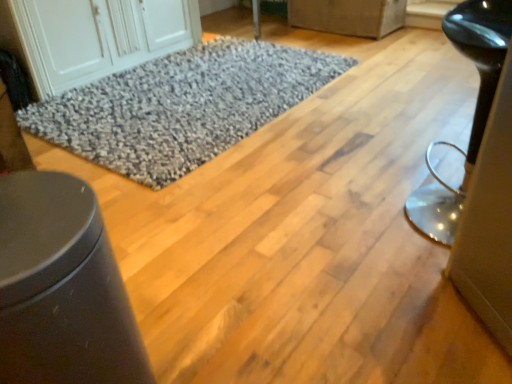
What is the approximate height of gray shaggy rug at center?

It is 4.48 centimeters.

Locate an element on the screen. This screenshot has height=384, width=512. white wood cabinet at upper left is located at coordinates (99, 36).

Is matte black trash can at lower left, marked as the third furniture in a back-to-front arrangement, not within white wood cabinet at upper left?

Yes.

From a real-world perspective, is matte black trash can at lower left, marked as the third furniture in a back-to-front arrangement, located beneath white wood cabinet at upper left?

Incorrect, from a real-world perspective, matte black trash can at lower left, marked as the third furniture in a back-to-front arrangement, is higher than white wood cabinet at upper left.

From the image's perspective, is matte black trash can at lower left, which is the 1th furniture from bottom to top, beneath white wood cabinet at upper left?

Correct, matte black trash can at lower left, which is the 1th furniture from bottom to top, appears lower than white wood cabinet at upper left in the image.

Is matte black trash can at lower left, marked as the third furniture in a back-to-front arrangement, thinner than white wood cabinet at upper left?

Yes.

From a real-world perspective, is glossy black stool at right, which is counted as the second furniture, starting from the left, below matte black trash can at lower left, marked as the third furniture in a back-to-front arrangement?

Incorrect, from a real-world perspective, glossy black stool at right, which is counted as the second furniture, starting from the left, is higher than matte black trash can at lower left, marked as the third furniture in a back-to-front arrangement.

Between glossy black stool at right, which appears as the second furniture when viewed from the top, and matte black trash can at lower left, marked as the third furniture in a back-to-front arrangement, which one has more height?

glossy black stool at right, which appears as the second furniture when viewed from the top.

The width and height of the screenshot is (512, 384). I want to click on furniture below the glossy black stool at right, which appears as the 2th furniture when viewed from the back (from the image's perspective), so click(x=62, y=288).

Where is `cabinetry that appears above the gray shaggy rug at center (from the image's perspective)`? Image resolution: width=512 pixels, height=384 pixels. cabinetry that appears above the gray shaggy rug at center (from the image's perspective) is located at coordinates (99, 36).

How different are the orientations of white wood cabinet at upper left and gray shaggy rug at center in degrees?

90 degrees.

Is white wood cabinet at upper left turned away from gray shaggy rug at center?

That's not correct — white wood cabinet at upper left is not looking away from gray shaggy rug at center.

Visually, is white wood cabinet at upper left positioned to the left or to the right of gray shaggy rug at center?

In the image, white wood cabinet at upper left appears on the left side of gray shaggy rug at center.

Find the location of `mat to the left of matte gray fabric couch at upper center, placed as the 3th furniture when sorted from bottom to top`. mat to the left of matte gray fabric couch at upper center, placed as the 3th furniture when sorted from bottom to top is located at coordinates (181, 106).

Which point is more forward, (160, 186) or (322, 13)?

The point (160, 186) is in front.

In the scene shown: Is gray shaggy rug at center looking in the opposite direction of matte gray fabric couch at upper center, marked as the 1th furniture in a right-to-left arrangement?

Yes, gray shaggy rug at center is facing away from matte gray fabric couch at upper center, marked as the 1th furniture in a right-to-left arrangement.

From a real-world perspective, is gray shaggy rug at center over matte gray fabric couch at upper center, the first furniture from the back?

Incorrect, from a real-world perspective, gray shaggy rug at center is lower than matte gray fabric couch at upper center, the first furniture from the back.

From the picture: From a real-world perspective, is matte black trash can at lower left, placed as the 1th furniture when sorted from left to right, under glossy black stool at right, acting as the 2th furniture starting from the right?

Yes, from a real-world perspective, matte black trash can at lower left, placed as the 1th furniture when sorted from left to right, is below glossy black stool at right, acting as the 2th furniture starting from the right.

Relative to glossy black stool at right, which appears as the second furniture when viewed from the top, is matte black trash can at lower left, the third furniture in the top-to-bottom sequence, in front or behind?

Visually, matte black trash can at lower left, the third furniture in the top-to-bottom sequence, is located in front of glossy black stool at right, which appears as the second furniture when viewed from the top.

Can we say matte black trash can at lower left, which is the first furniture in front-to-back order, lies outside matte gray fabric couch at upper center, the first furniture from the back?

Yes, matte black trash can at lower left, which is the first furniture in front-to-back order, is located beyond the bounds of matte gray fabric couch at upper center, the first furniture from the back.

Based on the photo, how distant is matte black trash can at lower left, placed as the 1th furniture when sorted from left to right, from matte gray fabric couch at upper center, placed as the 3th furniture when sorted from bottom to top?

They are 3.13 meters apart.

Looking at this image, is matte black trash can at lower left, the third furniture in the top-to-bottom sequence, at the right side of matte gray fabric couch at upper center, the third furniture in the left-to-right sequence?

No, matte black trash can at lower left, the third furniture in the top-to-bottom sequence, is not to the right of matte gray fabric couch at upper center, the third furniture in the left-to-right sequence.

Consider the image. From a real-world perspective, who is located higher, matte black trash can at lower left, placed as the 1th furniture when sorted from left to right, or matte gray fabric couch at upper center, the first furniture viewed from the top?

In real-world perspective, matte black trash can at lower left, placed as the 1th furniture when sorted from left to right, is above.

From a real-world perspective, which object rests below the other?

From a 3D spatial view, white wood cabinet at upper left is below.

Which of these two, glossy black stool at right, acting as the 2th furniture starting from the right, or white wood cabinet at upper left, is wider?

white wood cabinet at upper left is wider.

Is glossy black stool at right, the 2th furniture from the bottom, aimed at white wood cabinet at upper left?

No, glossy black stool at right, the 2th furniture from the bottom, is not turned towards white wood cabinet at upper left.

Does point (481, 15) appear closer or farther from the camera than point (145, 55)?

Point (481, 15).

Where is `cabinetry lying behind the matte black trash can at lower left, the third furniture in the top-to-bottom sequence`? The width and height of the screenshot is (512, 384). cabinetry lying behind the matte black trash can at lower left, the third furniture in the top-to-bottom sequence is located at coordinates (99, 36).

Image resolution: width=512 pixels, height=384 pixels. I want to click on furniture above the matte black trash can at lower left, the third furniture in the top-to-bottom sequence (from a real-world perspective), so click(475, 109).

From the image, which object appears to be farther from gray shaggy rug at center, matte gray fabric couch at upper center, marked as the 1th furniture in a right-to-left arrangement, or white wood cabinet at upper left?

matte gray fabric couch at upper center, marked as the 1th furniture in a right-to-left arrangement, is further to gray shaggy rug at center.

Which object lies nearer to the anchor point matte gray fabric couch at upper center, the third furniture in the left-to-right sequence, gray shaggy rug at center or glossy black stool at right, the 2th furniture from the bottom?

The object closer to matte gray fabric couch at upper center, the third furniture in the left-to-right sequence, is gray shaggy rug at center.

Looking at the image, which one is located closer to glossy black stool at right, acting as the 2th furniture starting from the right, matte gray fabric couch at upper center, the first furniture viewed from the top, or gray shaggy rug at center?

gray shaggy rug at center.

Estimate the real-world distances between objects in this image. Which object is closer to matte black trash can at lower left, marked as the third furniture in a back-to-front arrangement, matte gray fabric couch at upper center, placed as the 3th furniture when sorted from bottom to top, or white wood cabinet at upper left?

white wood cabinet at upper left is positioned closer to the anchor matte black trash can at lower left, marked as the third furniture in a back-to-front arrangement.

From the image, which object appears to be nearer to white wood cabinet at upper left, glossy black stool at right, which appears as the 2th furniture when viewed from the back, or matte black trash can at lower left, the third furniture in the top-to-bottom sequence?

The object closer to white wood cabinet at upper left is glossy black stool at right, which appears as the 2th furniture when viewed from the back.

From the image, which object appears to be nearer to matte black trash can at lower left, which is the 1th furniture from bottom to top, white wood cabinet at upper left or gray shaggy rug at center?

Among the two, gray shaggy rug at center is located nearer to matte black trash can at lower left, which is the 1th furniture from bottom to top.

When comparing their distances from matte gray fabric couch at upper center, placed as the 3th furniture when sorted from bottom to top, does glossy black stool at right, which appears as the second furniture when viewed from the top, or gray shaggy rug at center seem closer?

gray shaggy rug at center is closer to matte gray fabric couch at upper center, placed as the 3th furniture when sorted from bottom to top.

Based on their spatial positions, is white wood cabinet at upper left or glossy black stool at right, which appears as the 2th furniture when viewed from the back, closer to matte gray fabric couch at upper center, marked as the 1th furniture in a right-to-left arrangement?

Among the two, white wood cabinet at upper left is located nearer to matte gray fabric couch at upper center, marked as the 1th furniture in a right-to-left arrangement.

This screenshot has height=384, width=512. I want to click on mat between white wood cabinet at upper left and glossy black stool at right, which is the second furniture from front to back, so click(x=181, y=106).

Where is `mat between matte black trash can at lower left, marked as the third furniture in a back-to-front arrangement, and matte gray fabric couch at upper center, the third furniture in the left-to-right sequence, from front to back`? This screenshot has width=512, height=384. mat between matte black trash can at lower left, marked as the third furniture in a back-to-front arrangement, and matte gray fabric couch at upper center, the third furniture in the left-to-right sequence, from front to back is located at coordinates (181, 106).

Where is `mat between white wood cabinet at upper left and matte gray fabric couch at upper center, the first furniture from the back, in the horizontal direction`? mat between white wood cabinet at upper left and matte gray fabric couch at upper center, the first furniture from the back, in the horizontal direction is located at coordinates (181, 106).

Where is `furniture between matte black trash can at lower left, which is the first furniture in front-to-back order, and matte gray fabric couch at upper center, the first furniture from the back, in the front-back direction`? furniture between matte black trash can at lower left, which is the first furniture in front-to-back order, and matte gray fabric couch at upper center, the first furniture from the back, in the front-back direction is located at coordinates (475, 109).